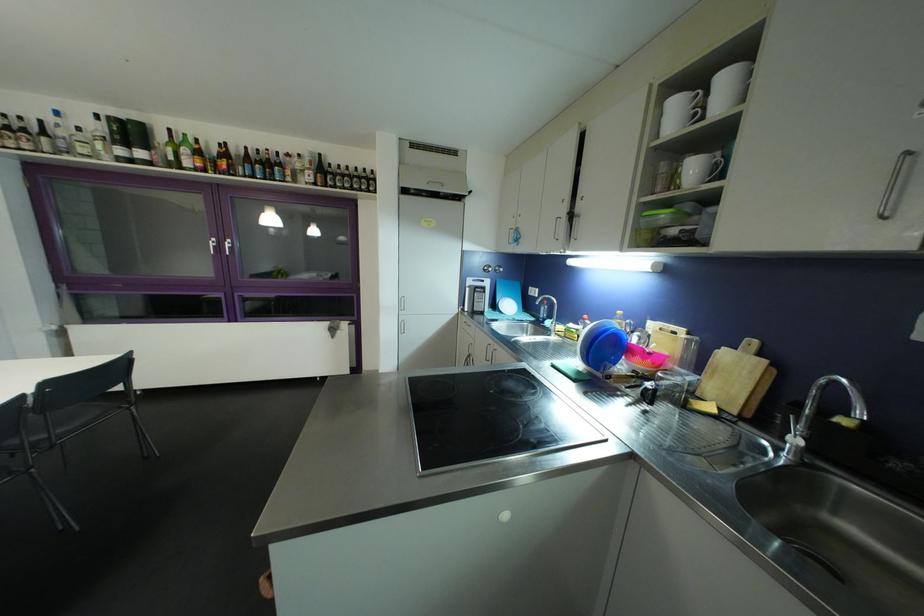
The image size is (924, 616). I want to click on silver window handle, so (x=211, y=245).